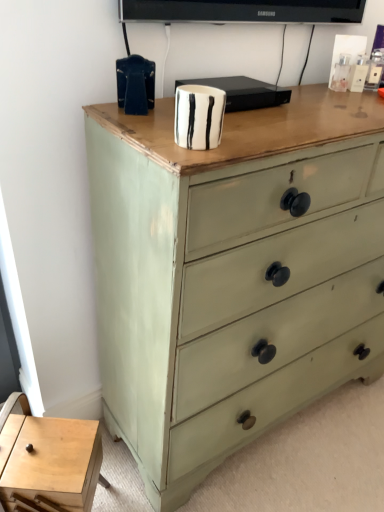
Where is `light wood table at lower left`? This screenshot has height=512, width=384. light wood table at lower left is located at coordinates (53, 466).

This screenshot has height=512, width=384. What do you see at coordinates (53, 466) in the screenshot? I see `light wood table at lower left` at bounding box center [53, 466].

Describe the element at coordinates (232, 274) in the screenshot. I see `sage green painted wood chest of drawers at center` at that location.

At what (x,y) coordinates should I click in order to perform the action: click on sage green painted wood chest of drawers at center. Please return your answer as a coordinate pair (x, y). Image resolution: width=384 pixels, height=512 pixels. Looking at the image, I should click on (232, 274).

The image size is (384, 512). Find the location of `light wood table at lower left`. light wood table at lower left is located at coordinates (53, 466).

Considering the positions of objects sage green painted wood chest of drawers at center and light wood table at lower left in the image provided, who is more to the right, sage green painted wood chest of drawers at center or light wood table at lower left?

Positioned to the right is sage green painted wood chest of drawers at center.

Based on the photo, is the position of sage green painted wood chest of drawers at center more distant than that of light wood table at lower left?

No, it is in front of light wood table at lower left.

Considering the positions of points (178, 290) and (89, 505), is point (178, 290) closer to camera compared to point (89, 505)?

That is True.

From the image's perspective, is sage green painted wood chest of drawers at center located above or below light wood table at lower left?

sage green painted wood chest of drawers at center is situated higher than light wood table at lower left in the image.

From a real-world perspective, is sage green painted wood chest of drawers at center below light wood table at lower left?

No.

Which object is thinner, sage green painted wood chest of drawers at center or light wood table at lower left?

light wood table at lower left is thinner.

Can you confirm if sage green painted wood chest of drawers at center is taller than light wood table at lower left?

Yes.

Which of these two, sage green painted wood chest of drawers at center or light wood table at lower left, is bigger?

sage green painted wood chest of drawers at center.

Is sage green painted wood chest of drawers at center spatially inside light wood table at lower left, or outside of it?

sage green painted wood chest of drawers at center exists outside the volume of light wood table at lower left.

Would you consider sage green painted wood chest of drawers at center to be distant from light wood table at lower left?

sage green painted wood chest of drawers at center is near light wood table at lower left, not far away.

Is sage green painted wood chest of drawers at center looking in the opposite direction of light wood table at lower left?

sage green painted wood chest of drawers at center is not turned away from light wood table at lower left.

How different are the orientations of sage green painted wood chest of drawers at center and light wood table at lower left in degrees?

The angle between the facing direction of sage green painted wood chest of drawers at center and the facing direction of light wood table at lower left is 37.1 degrees.

Could you measure the distance between sage green painted wood chest of drawers at center and light wood table at lower left?

20.25 inches.

What are the coordinates of `table below the sage green painted wood chest of drawers at center (from the image's perspective)` in the screenshot? It's located at (53, 466).

In the image, is light wood table at lower left on the left side or the right side of sage green painted wood chest of drawers at center?

Based on their positions, light wood table at lower left is located to the left of sage green painted wood chest of drawers at center.

Which object is more forward, light wood table at lower left or sage green painted wood chest of drawers at center?

sage green painted wood chest of drawers at center.

Does point (39, 472) lie behind point (363, 286)?

No, (39, 472) is closer to viewer.

From the image's perspective, is light wood table at lower left under sage green painted wood chest of drawers at center?

Yes, from the image's perspective, light wood table at lower left is below sage green painted wood chest of drawers at center.

From a real-world perspective, between light wood table at lower left and sage green painted wood chest of drawers at center, who is vertically lower?

In real-world perspective, light wood table at lower left is lower.

Can you confirm if light wood table at lower left is wider than sage green painted wood chest of drawers at center?

Incorrect, the width of light wood table at lower left does not surpass that of sage green painted wood chest of drawers at center.

Considering the relative sizes of light wood table at lower left and sage green painted wood chest of drawers at center in the image provided, is light wood table at lower left shorter than sage green painted wood chest of drawers at center?

Correct, light wood table at lower left is not as tall as sage green painted wood chest of drawers at center.

Is light wood table at lower left bigger than sage green painted wood chest of drawers at center?

No.

Is light wood table at lower left outside of sage green painted wood chest of drawers at center?

Yes, light wood table at lower left is outside of sage green painted wood chest of drawers at center.

Are light wood table at lower left and sage green painted wood chest of drawers at center located far from each other?

Actually, light wood table at lower left and sage green painted wood chest of drawers at center are a little close together.

Is light wood table at lower left facing away from sage green painted wood chest of drawers at center?

No, light wood table at lower left's orientation is not away from sage green painted wood chest of drawers at center.

Where is `the chest of drawers located above the light wood table at lower left (from a real-world perspective)`? the chest of drawers located above the light wood table at lower left (from a real-world perspective) is located at coordinates (232, 274).

The width and height of the screenshot is (384, 512). What are the coordinates of `chest of drawers in front of the light wood table at lower left` in the screenshot? It's located at [232, 274].

I want to click on table that is below the sage green painted wood chest of drawers at center (from the image's perspective), so click(x=53, y=466).